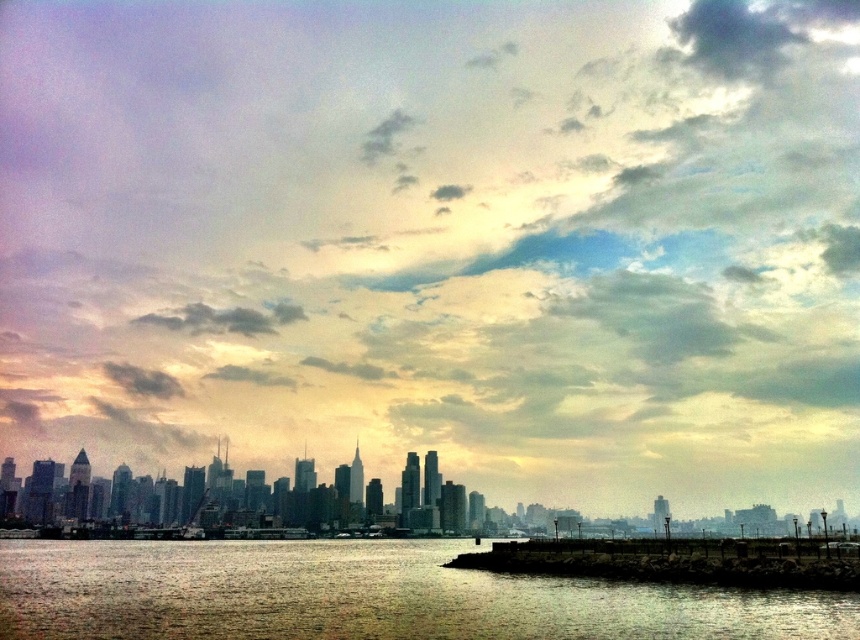
Question: Among these points, which one is farthest from the camera?

Choices:
 (A) (643, 570)
 (B) (728, 470)
 (C) (131, 320)

Answer: (B)

Question: Is rocky concrete wall at lower right above dark gray cloud at upper center?

Choices:
 (A) yes
 (B) no

Answer: (B)

Question: Can you confirm if reflective silver water at lower center is thinner than dark gray cloud at upper center?

Choices:
 (A) no
 (B) yes

Answer: (A)

Question: Which point is closer to the camera?

Choices:
 (A) (467, 570)
 (B) (222, 317)
 (C) (289, 179)

Answer: (A)

Question: Which of the following is the closest to the observer?

Choices:
 (A) dark gray cloud at upper center
 (B) cloudy sky at upper center

Answer: (B)

Question: Is reflective silver water at lower center closer to the viewer compared to dark gray cloud at upper center?

Choices:
 (A) no
 (B) yes

Answer: (B)